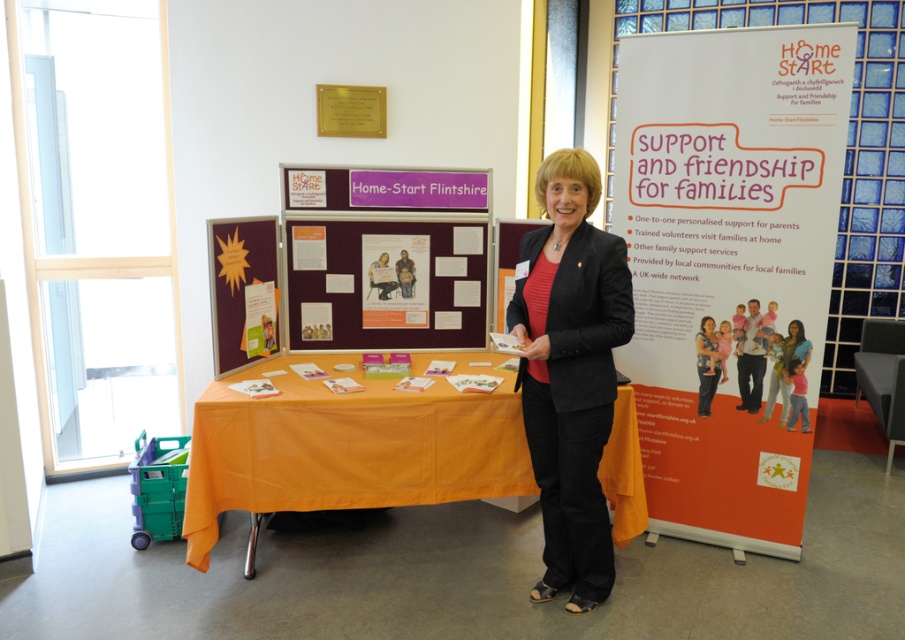
Looking at the scene, where is the orange fabric table at center in relation to the matte paper poster at center?

The orange fabric table at center is to the left of the matte paper poster at center.

You are organizing an event and need to decide which item to move first. Since the orange fabric table at center is bigger than the maroon fabric poster at center, which item would require more space to store?

The orange fabric table at center requires more space to store because it is bigger than the maroon fabric poster at center.

What are the coordinates of the orange fabric table at center?

The orange fabric table at center is located at coordinates point [350,444].